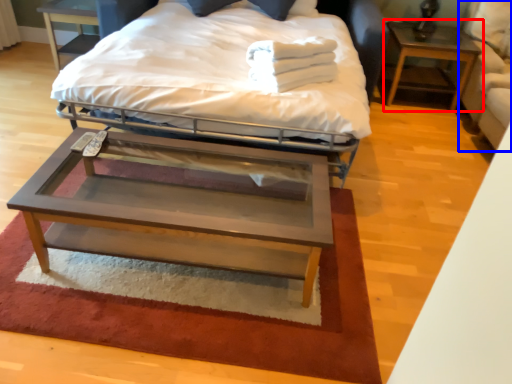
Question: Which of the following is the farthest to the observer, nightstand (highlighted by a red box) or swivel chair (highlighted by a blue box)?

Choices:
 (A) nightstand
 (B) swivel chair

Answer: (A)